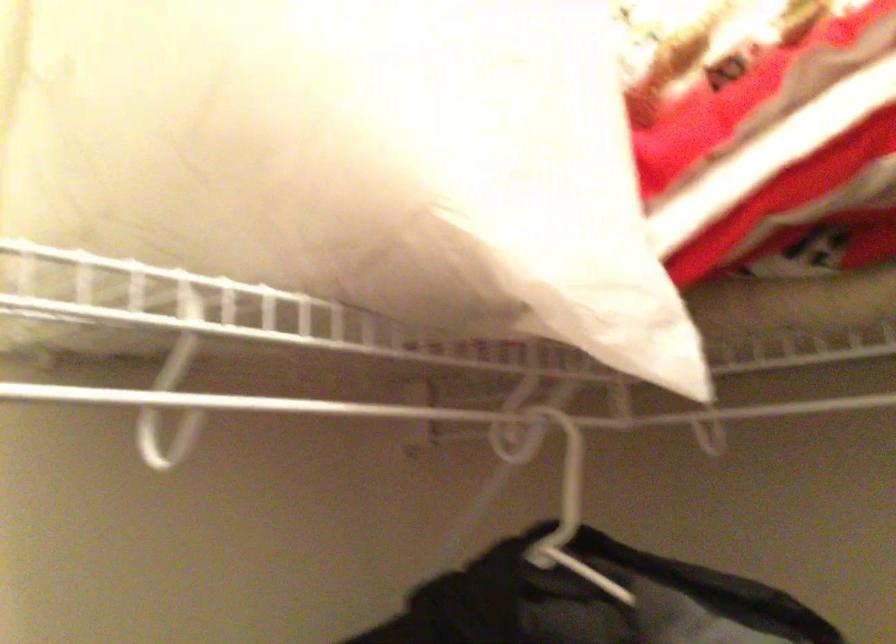
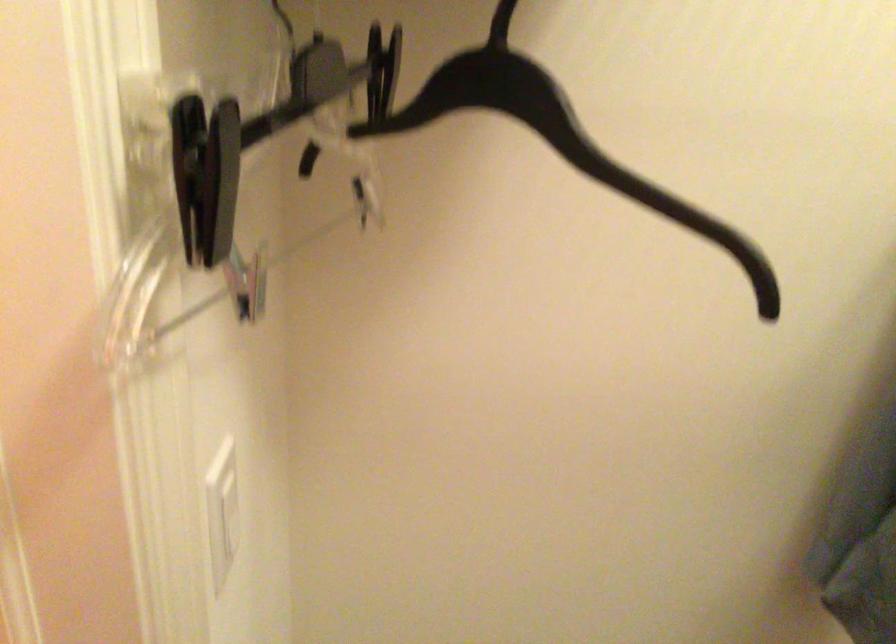
How did the camera likely rotate?

The camera rotated toward left-down.